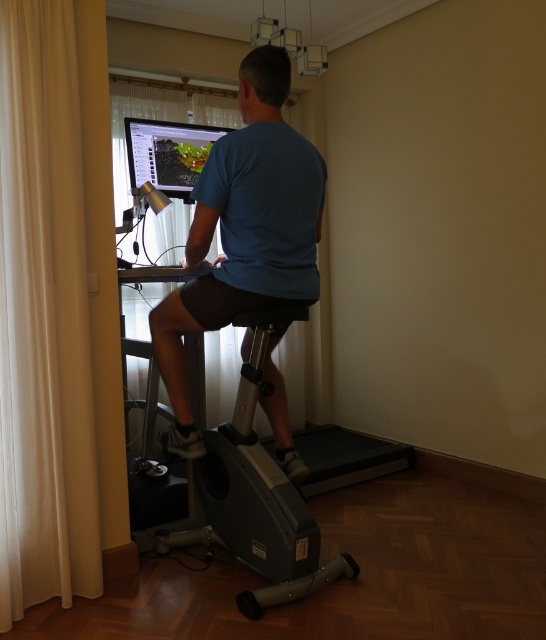
Between white fabric curtain at left and blue matte shirt at center, which one has less height?

blue matte shirt at center

This screenshot has height=640, width=546. Identify the location of white fabric curtain at left. (44, 317).